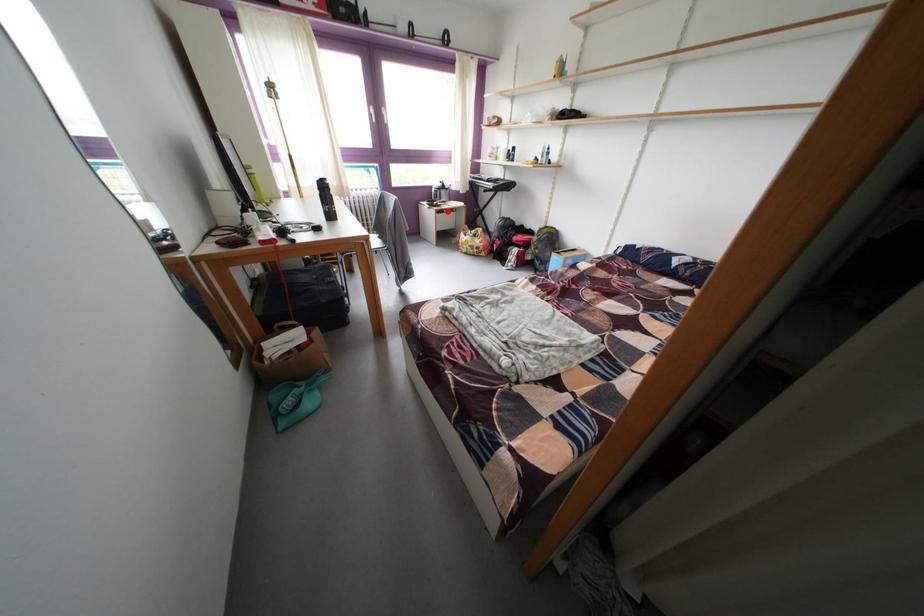
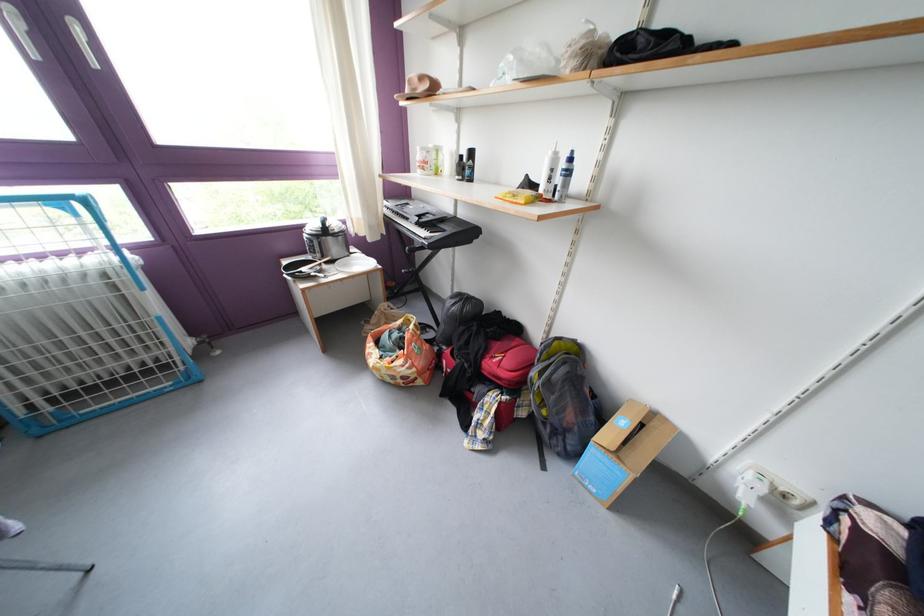
Question: I am providing you with two images of the same scene from different viewpoints. In image1, a red point is highlighted. Considering the same 3D point in image2, which of the following is correct?

Choices:
 (A) It is closer
 (B) It is farther

Answer: (B)